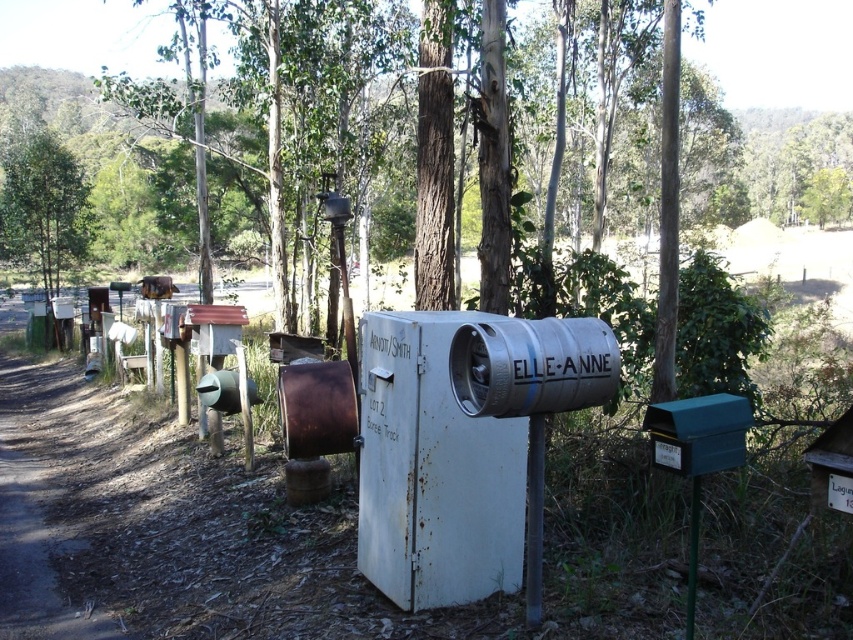
Question: Is rusty metal mailbox at center thinner than green leafy tree at upper left?

Choices:
 (A) yes
 (B) no

Answer: (B)

Question: In this image, where is rusty metal mailbox at center located relative to green leafy tree at upper left?

Choices:
 (A) below
 (B) above

Answer: (A)

Question: Can you confirm if rusty metal mailbox at center is thinner than green leafy tree at upper left?

Choices:
 (A) yes
 (B) no

Answer: (B)

Question: Among these points, which one is farthest from the camera?

Choices:
 (A) (80, 209)
 (B) (486, 483)

Answer: (A)